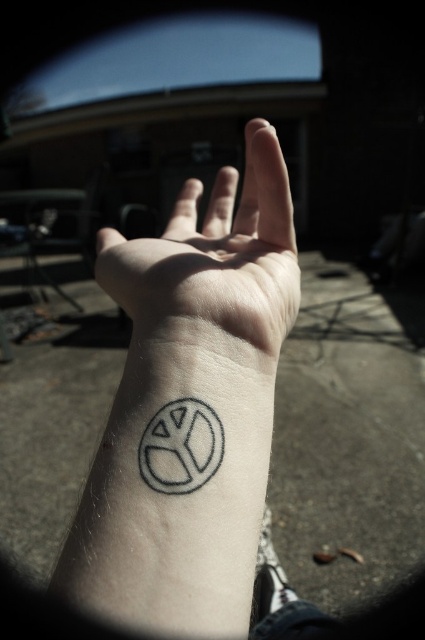
Question: Does pale skin at center have a lesser width compared to gray ink peace sign at lower center?

Choices:
 (A) yes
 (B) no

Answer: (B)

Question: Which of the following is the farthest from the observer?

Choices:
 (A) (155, 305)
 (B) (183, 230)

Answer: (B)

Question: Can you confirm if black ink tattoo at lower left is bigger than pale skin at center?

Choices:
 (A) yes
 (B) no

Answer: (A)

Question: Among these objects, which one is farthest from the camera?

Choices:
 (A) black ink tattoo at lower left
 (B) gray ink peace sign at lower center

Answer: (B)

Question: Does black ink tattoo at lower left appear on the right side of pale skin at center?

Choices:
 (A) yes
 (B) no

Answer: (A)

Question: Which is nearer to the gray ink peace sign at lower center?

Choices:
 (A) pale skin at center
 (B) black ink tattoo at lower left

Answer: (B)